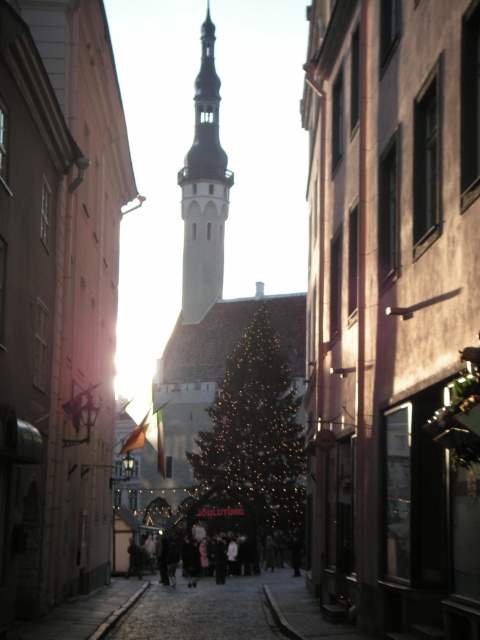
Can you confirm if illuminated gold christmas tree at center is positioned below dark clothing at center?

Incorrect, illuminated gold christmas tree at center is not positioned below dark clothing at center.

Is point (248, 429) behind point (244, 572)?

Yes.

Who is more forward, (244,502) or (216,580)?

Point (216,580) is in front.

At what (x,y) coordinates should I click in order to perform the action: click on illuminated gold christmas tree at center. Please return your answer as a coordinate pair (x, y). Image resolution: width=480 pixels, height=640 pixels. Looking at the image, I should click on (252, 436).

Can you confirm if illuminated gold christmas tree at center is positioned to the right of smooth stone bell tower at center?

Correct, you'll find illuminated gold christmas tree at center to the right of smooth stone bell tower at center.

This screenshot has height=640, width=480. Find the location of `illuminated gold christmas tree at center`. illuminated gold christmas tree at center is located at coordinates (252, 436).

I want to click on illuminated gold christmas tree at center, so click(252, 436).

Which is above, smooth stone bell tower at center or dark clothing at center?

smooth stone bell tower at center

What are the coordinates of `smooth stone bell tower at center` in the screenshot? It's located at (204, 192).

Where is `smooth stone bell tower at center`? smooth stone bell tower at center is located at coordinates [x=204, y=192].